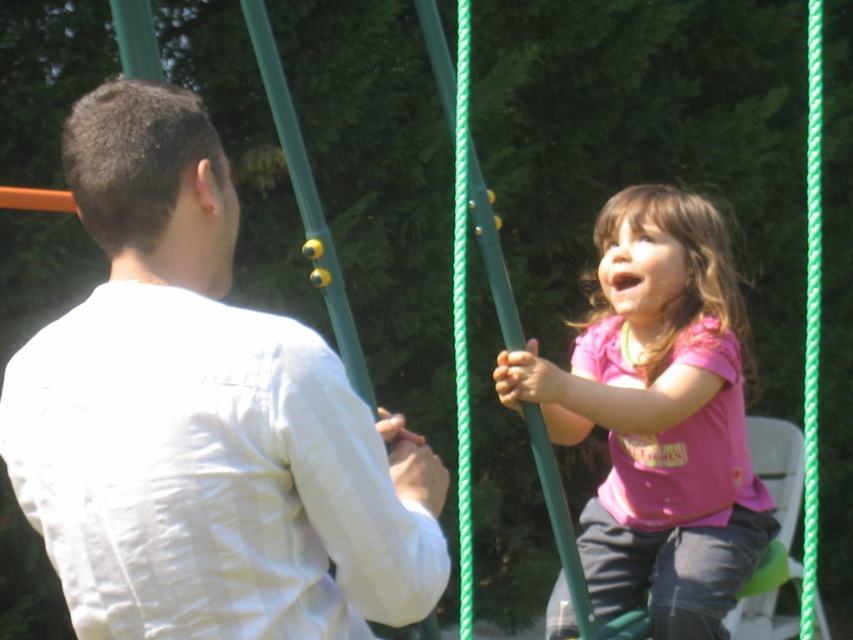
Based on the scene description, which object is shorter between the white cotton shirt at upper left and the pink matte shirt at center?

The white cotton shirt at upper left is shorter than the pink matte shirt at center.

You are standing at the center of the playground and see the white cotton shirt at upper left. Which direction should you move to get closer to it?

The white cotton shirt at upper left is located at point 0.656 on the x and 0.239 on the y coordinate. Since you are at the center, you should move towards the upper left direction to get closer to it.

Based on the photo, you are designing a new clothing catalog and need to place the white cotton shirt at upper left and the pink matte shirt at center in a layout. The catalog requires that the wider item should be placed on the left side for visual balance. Based on the image description, which shirt should be positioned on the left?

The pink matte shirt at center should be placed on the left side because it is wider than the white cotton shirt at upper left, fulfilling the catalog requirement for visual balance.